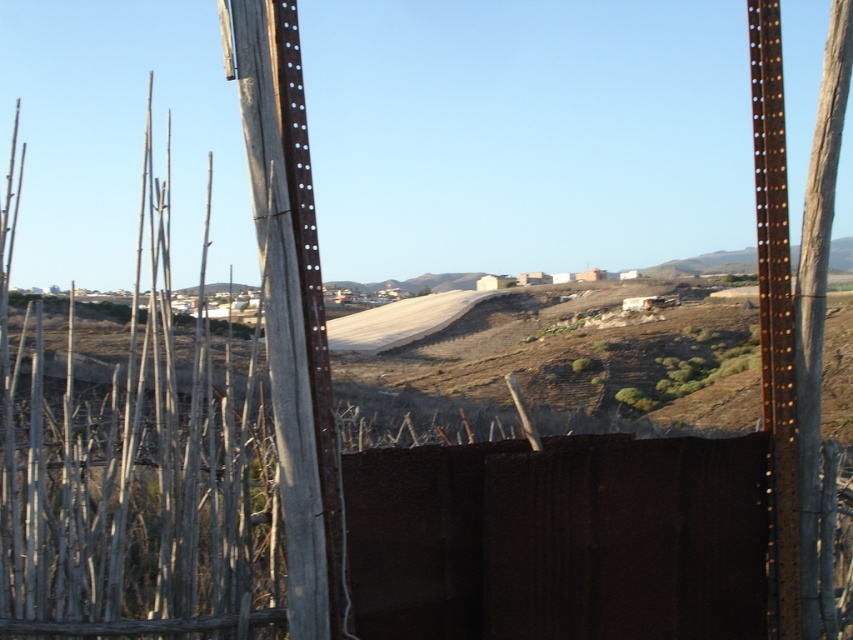
Consider the image. You are standing in front of the rusty metal fence at center and the rusty metal pole at right. Which object is nearer to you?

The rusty metal fence at center is closer to the viewer than the rusty metal pole at right.

You are standing in the rural landscape and see the point marked at coordinates (291, 307). What object is located exactly at that point?

The rusty metal pole at center is located exactly at point (291, 307).